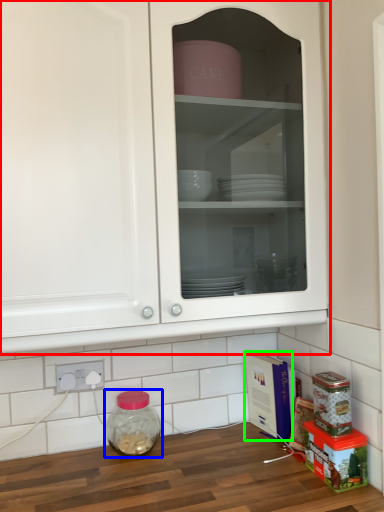
Question: Considering the real-world distances, which object is farthest from cabinetry (highlighted by a red box)? glass jar (highlighted by a blue box) or cardboard box (highlighted by a green box)?

Choices:
 (A) glass jar
 (B) cardboard box

Answer: (B)